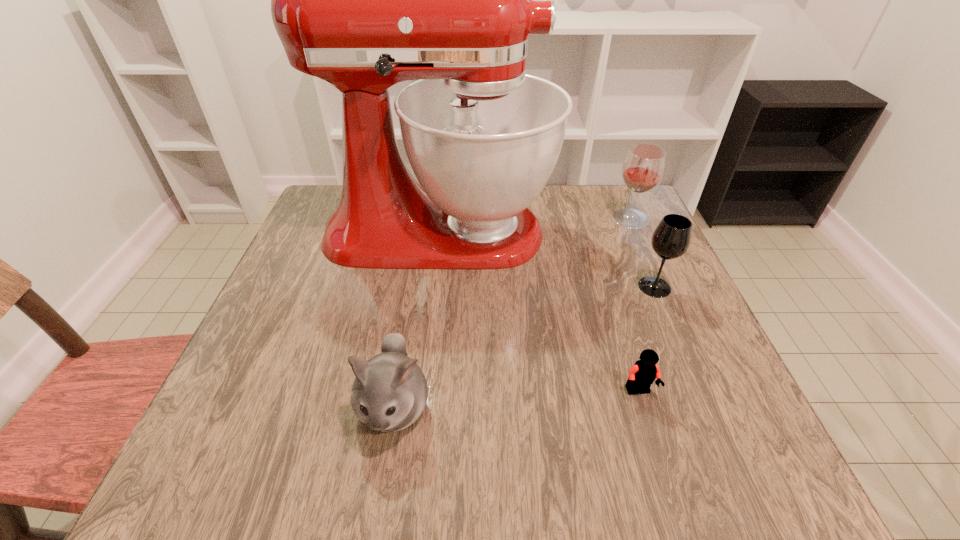
The height and width of the screenshot is (540, 960). I want to click on mixer that is at the far edge, so point(363,0).

In order to click on wineglass that is positioned at the far edge in this screenshot , I will do `click(643, 168)`.

Identify the location of object located in the near edge section of the desktop. (389, 393).

Find the location of a particular element. object located at the left edge is located at coordinates (363, 0).

I want to click on Lego at the right edge, so click(x=644, y=372).

At what (x,y) coordinates should I click in order to perform the action: click on object positioned at the far left corner. Please return your answer as a coordinate pair (x, y). The image size is (960, 540). Looking at the image, I should click on [363, 0].

Image resolution: width=960 pixels, height=540 pixels. In order to click on object present at the far right corner in this screenshot , I will do `click(643, 168)`.

This screenshot has width=960, height=540. In order to click on free space at the far edge of the desktop in this screenshot , I will do `click(579, 207)`.

Locate an element on the screen. This screenshot has width=960, height=540. vacant area at the near edge is located at coordinates (413, 465).

In the image, there is a desktop. Identify the location of vacant space at the left edge. The width and height of the screenshot is (960, 540). (294, 269).